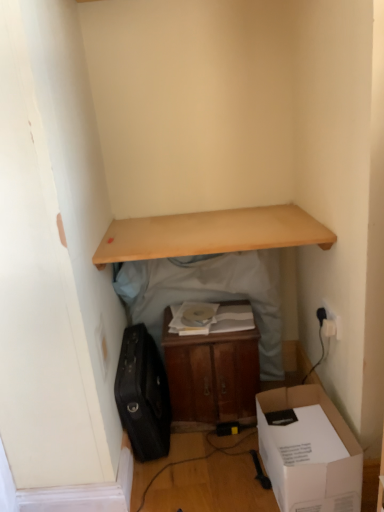
Question: Does white plastic electric outlet at upper right have a greater width compared to wooden shelf at upper center, arranged as the second table when viewed from the left?

Choices:
 (A) no
 (B) yes

Answer: (A)

Question: Is white plastic electric outlet at upper right positioned beyond the bounds of wooden shelf at upper center, arranged as the second table when viewed from the left?

Choices:
 (A) no
 (B) yes

Answer: (B)

Question: Is white plastic electric outlet at upper right at the left side of wooden shelf at upper center, placed as the 1th table when sorted from right to left?

Choices:
 (A) yes
 (B) no

Answer: (B)

Question: Considering the relative sizes of white plastic electric outlet at upper right and wooden shelf at upper center, placed as the 1th table when sorted from right to left, in the image provided, is white plastic electric outlet at upper right smaller than wooden shelf at upper center, placed as the 1th table when sorted from right to left,?

Choices:
 (A) no
 (B) yes

Answer: (B)

Question: Can wooden shelf at upper center, arranged as the second table when viewed from the left, be found inside white plastic electric outlet at upper right?

Choices:
 (A) no
 (B) yes

Answer: (A)

Question: In the image, is white plastic electric outlet at upper right on the left side or the right side of wooden cabinet at center, marked as the 1th table in a left-to-right arrangement?

Choices:
 (A) left
 (B) right

Answer: (B)

Question: Considering the positions of white plastic electric outlet at upper right and wooden cabinet at center, marked as the 1th table in a left-to-right arrangement, in the image, is white plastic electric outlet at upper right taller or shorter than wooden cabinet at center, marked as the 1th table in a left-to-right arrangement,?

Choices:
 (A) tall
 (B) short

Answer: (B)

Question: From the image's perspective, is white plastic electric outlet at upper right above or below wooden cabinet at center, the second table in the right-to-left sequence?

Choices:
 (A) above
 (B) below

Answer: (A)

Question: From a real-world perspective, is white plastic electric outlet at upper right positioned above or below wooden cabinet at center, the second table in the right-to-left sequence?

Choices:
 (A) above
 (B) below

Answer: (A)

Question: Considering the positions of point (155, 217) and point (215, 364), is point (155, 217) closer or farther from the camera than point (215, 364)?

Choices:
 (A) closer
 (B) farther

Answer: (B)

Question: Looking at the image, does light wood shelf at upper center seem bigger or smaller compared to wooden cabinet at center, the second table in the right-to-left sequence?

Choices:
 (A) big
 (B) small

Answer: (B)

Question: Considering the positions of light wood shelf at upper center and wooden cabinet at center, the second table in the right-to-left sequence, in the image, is light wood shelf at upper center wider or thinner than wooden cabinet at center, the second table in the right-to-left sequence,?

Choices:
 (A) wide
 (B) thin

Answer: (A)

Question: Based on their positions, is light wood shelf at upper center located to the left or right of wooden cabinet at center, marked as the 1th table in a left-to-right arrangement?

Choices:
 (A) left
 (B) right

Answer: (A)

Question: From the image's perspective, is white plastic electric outlet at upper right above or below white cardboard box at lower right?

Choices:
 (A) above
 (B) below

Answer: (A)

Question: In terms of width, does white plastic electric outlet at upper right look wider or thinner when compared to white cardboard box at lower right?

Choices:
 (A) wide
 (B) thin

Answer: (B)